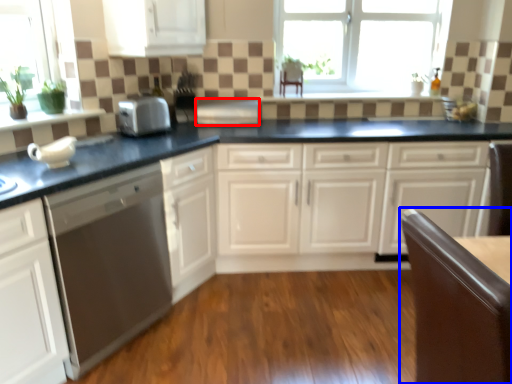
Question: Which of the following is the farthest to the observer, appliance (highlighted by a red box) or chair (highlighted by a blue box)?

Choices:
 (A) appliance
 (B) chair

Answer: (A)